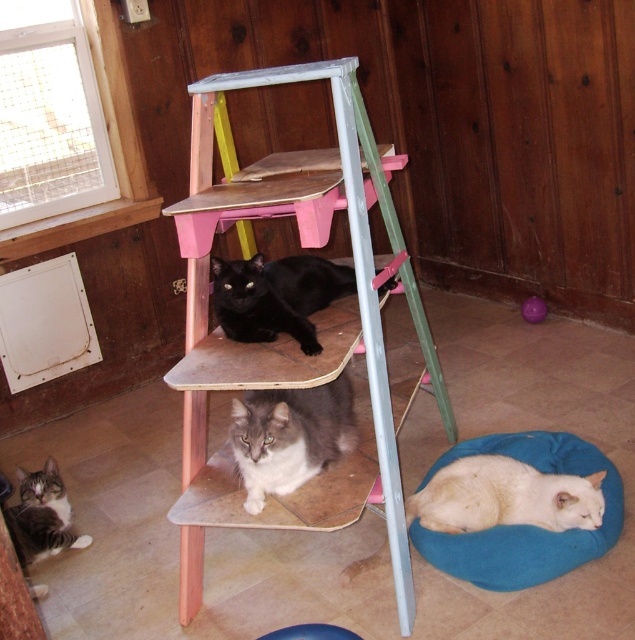
Question: Is white soft cat at lower right thinner than tabby fur cat at lower left?

Choices:
 (A) no
 (B) yes

Answer: (A)

Question: Which object appears closest to the camera in this image?

Choices:
 (A) blue fabric dog bed at lower right
 (B) black matte cat at center
 (C) pink wood step ladder at center
 (D) white soft cat at lower right

Answer: (C)

Question: Which object is positioned farthest from the black matte cat at center?

Choices:
 (A) blue fabric dog bed at lower right
 (B) gray fluffy cat at center
 (C) pink wood step ladder at center
 (D) white soft cat at lower right

Answer: (A)

Question: Can you confirm if white soft cat at lower right is positioned below black matte cat at center?

Choices:
 (A) yes
 (B) no

Answer: (A)

Question: Does gray fluffy cat at center lie in front of black matte cat at center?

Choices:
 (A) yes
 (B) no

Answer: (A)

Question: Which point appears farthest from the camera in this image?

Choices:
 (A) (255, 264)
 (B) (185, 499)
 (C) (254, 392)
 (D) (544, 444)

Answer: (D)